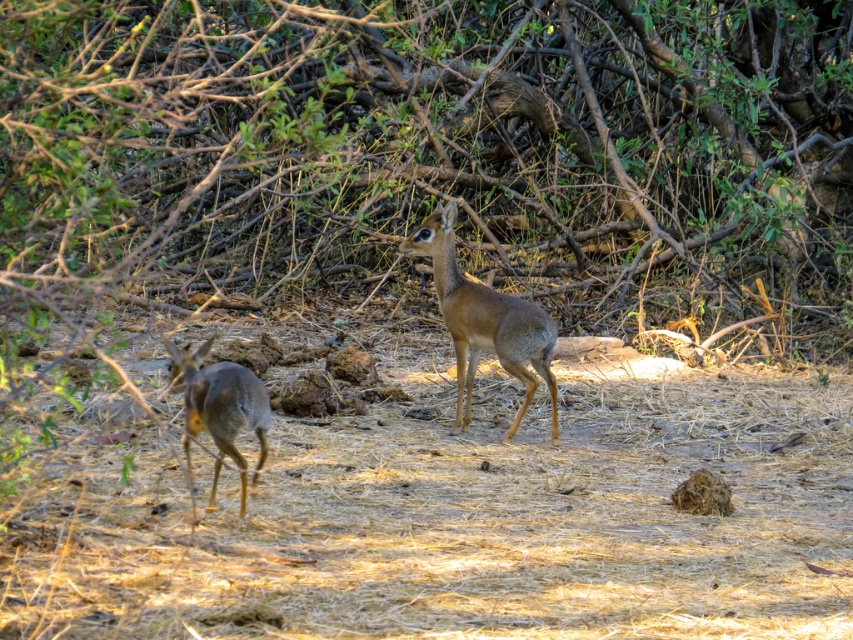
The height and width of the screenshot is (640, 853). What do you see at coordinates (485, 321) in the screenshot?
I see `brown furry deer at center` at bounding box center [485, 321].

Does brown furry deer at center have a greater width compared to brown fur deer at left?

Yes.

The width and height of the screenshot is (853, 640). Describe the element at coordinates (485, 321) in the screenshot. I see `brown furry deer at center` at that location.

Identify the location of brown furry deer at center. The height and width of the screenshot is (640, 853). (485, 321).